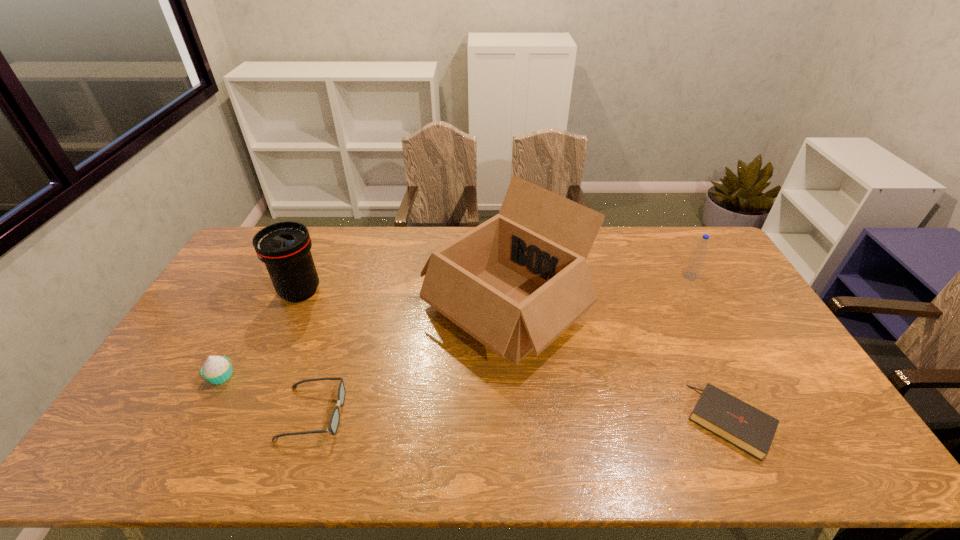
In order to click on vacant position located on the back of the water bottle in this screenshot , I will do `click(673, 244)`.

Where is `free space located on the back of the cupcake`? The image size is (960, 540). free space located on the back of the cupcake is located at coordinates (260, 303).

Locate an element on the screen. vacant space located on the face of the fourth object from right to left is located at coordinates (390, 414).

Locate an element on the screen. vacant space located on the back of the Bible is located at coordinates (689, 335).

Where is `object present at the far edge`? Image resolution: width=960 pixels, height=540 pixels. object present at the far edge is located at coordinates (516, 282).

The height and width of the screenshot is (540, 960). I want to click on spectacles present at the near edge, so click(x=335, y=417).

Locate an element on the screen. Bible located at the near edge is located at coordinates (744, 426).

The image size is (960, 540). I want to click on object positioned at the left edge, so click(217, 369).

The width and height of the screenshot is (960, 540). I want to click on water bottle at the right edge, so click(695, 263).

Find the location of a particular element. Bible that is at the right edge is located at coordinates (744, 426).